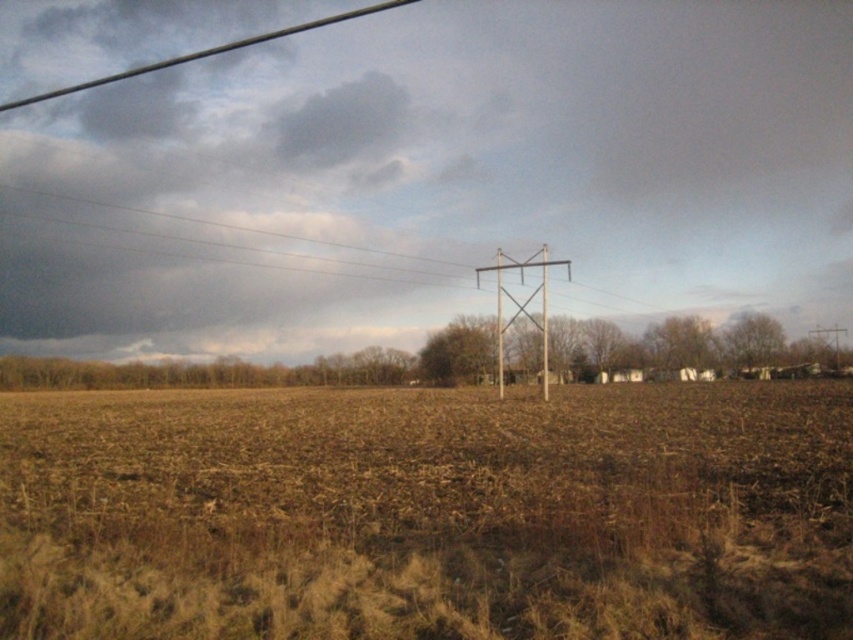
Question: Which object is closer to the camera taking this photo?

Choices:
 (A) brown grass at center
 (B) metallic wire at upper left

Answer: (A)

Question: Which is farther from the brown grass at center?

Choices:
 (A) metallic wire at upper left
 (B) smooth wood telegraph pole at center

Answer: (A)

Question: Is brown grass at center bigger than smooth wood telegraph pole at center?

Choices:
 (A) no
 (B) yes

Answer: (A)

Question: Considering the real-world distances, which object is farthest from the smooth wood telegraph pole at center?

Choices:
 (A) metallic wire at upper left
 (B) brown grass at center

Answer: (A)

Question: Does brown grass at center have a larger size compared to smooth wood telegraph pole at center?

Choices:
 (A) no
 (B) yes

Answer: (A)

Question: Does brown grass at center appear over metallic wire at upper left?

Choices:
 (A) no
 (B) yes

Answer: (A)